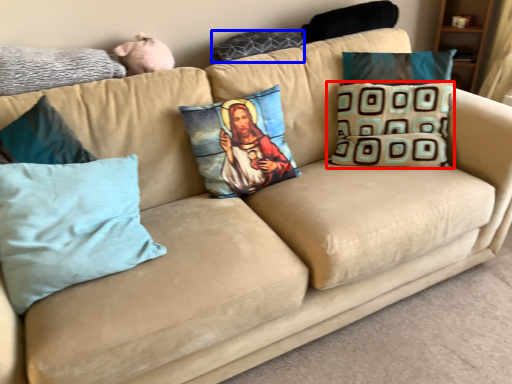
Question: Among these objects, which one is nearest to the camera, pillow (highlighted by a red box) or pillow (highlighted by a blue box)?

Choices:
 (A) pillow
 (B) pillow

Answer: (A)